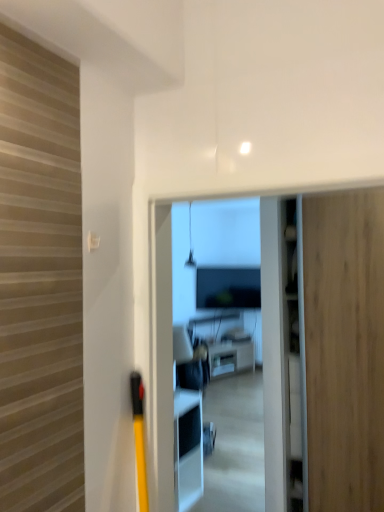
Describe the element at coordinates (230, 357) in the screenshot. I see `white glossy coffee table at center` at that location.

Measure the distance between point (248, 362) and camera.

Point (248, 362) and camera are 7.02 meters apart from each other.

This screenshot has width=384, height=512. In order to click on white glossy coffee table at center in this screenshot , I will do `click(230, 357)`.

The height and width of the screenshot is (512, 384). Describe the element at coordinates (344, 349) in the screenshot. I see `wooden door at right` at that location.

Measure the distance between wooden door at right and camera.

The distance of wooden door at right from camera is 2.39 meters.

The width and height of the screenshot is (384, 512). I want to click on wooden door at right, so click(x=344, y=349).

What is the approximate height of wooden door at right?

wooden door at right is 8.30 feet in height.

The width and height of the screenshot is (384, 512). I want to click on white glossy coffee table at center, so click(230, 357).

Can you confirm if wooden door at right is positioned to the left of white glossy coffee table at center?

No, wooden door at right is not to the left of white glossy coffee table at center.

Is the depth of wooden door at right less than that of white glossy coffee table at center?

Yes, wooden door at right is closer to the viewer.

Which is further, (315, 285) or (221, 353)?

Point (221, 353)

From the image's perspective, which object appears higher, wooden door at right or white glossy coffee table at center?

wooden door at right is shown above in the image.

From a real-world perspective, is wooden door at right physically located above or below white glossy coffee table at center?

wooden door at right is above white glossy coffee table at center.

Considering the sizes of wooden door at right and white glossy coffee table at center in the image, is wooden door at right wider or thinner than white glossy coffee table at center?

Clearly, wooden door at right has more width compared to white glossy coffee table at center.

Does wooden door at right have a lesser height compared to white glossy coffee table at center?

No, wooden door at right is not shorter than white glossy coffee table at center.

Can you confirm if wooden door at right is bigger than white glossy coffee table at center?

Indeed, wooden door at right has a larger size compared to white glossy coffee table at center.

Does wooden door at right contain white glossy coffee table at center?

No, white glossy coffee table at center is not inside wooden door at right.

Is wooden door at right with white glossy coffee table at center?

wooden door at right is not next to white glossy coffee table at center, and they're not touching.

Is wooden door at right looking in the opposite direction of white glossy coffee table at center?

wooden door at right is not turned away from white glossy coffee table at center.

Measure the distance between wooden door at right and white glossy coffee table at center.

wooden door at right is 4.38 meters from white glossy coffee table at center.

Locate an element on the screen. This screenshot has height=512, width=384. door located in front of the white glossy coffee table at center is located at coordinates (344, 349).

Is white glossy coffee table at center at the left side of wooden door at right?

Yes.

Considering the positions of objects white glossy coffee table at center and wooden door at right in the image provided, who is behind, white glossy coffee table at center or wooden door at right?

white glossy coffee table at center is behind.

Does point (231, 344) come in front of point (376, 387)?

No, (231, 344) is further to viewer.

From the image's perspective, which one is positioned higher, white glossy coffee table at center or wooden door at right?

From the image's view, wooden door at right is above.

From a real-world perspective, is white glossy coffee table at center located higher than wooden door at right?

No, from a real-world perspective, white glossy coffee table at center is not above wooden door at right.

Considering the relative sizes of white glossy coffee table at center and wooden door at right in the image provided, is white glossy coffee table at center wider than wooden door at right?

In fact, white glossy coffee table at center might be narrower than wooden door at right.

Is white glossy coffee table at center taller than wooden door at right?

Incorrect, the height of white glossy coffee table at center is not larger of that of wooden door at right.

Can you confirm if white glossy coffee table at center is smaller than wooden door at right?

Correct, white glossy coffee table at center occupies less space than wooden door at right.

Does white glossy coffee table at center contain wooden door at right?

Definitely not — wooden door at right is not inside white glossy coffee table at center.

Is white glossy coffee table at center not near wooden door at right?

That's right, there is a large distance between white glossy coffee table at center and wooden door at right.

Is white glossy coffee table at center aimed at wooden door at right?

No, white glossy coffee table at center is not aimed at wooden door at right.

How many degrees apart are the facing directions of white glossy coffee table at center and wooden door at right?

The angle between the facing direction of white glossy coffee table at center and the facing direction of wooden door at right is 67.4 degrees.

Measure the distance from white glossy coffee table at center to wooden door at right.

They are 4.38 meters apart.

At what (x,y) coordinates should I click in order to perform the action: click on door above the white glossy coffee table at center (from the image's perspective). Please return your answer as a coordinate pair (x, y). The height and width of the screenshot is (512, 384). Looking at the image, I should click on (344, 349).

You are a GUI agent. You are given a task and a screenshot of the screen. Output one action in this format:
    pyautogui.click(x=<x>, y=<y>)
    Task: Click on the furniture behind the wooden door at right
    The image size is (384, 512).
    Given the screenshot: What is the action you would take?
    pyautogui.click(x=230, y=357)

Image resolution: width=384 pixels, height=512 pixels. I want to click on door in front of the white glossy coffee table at center, so (344, 349).